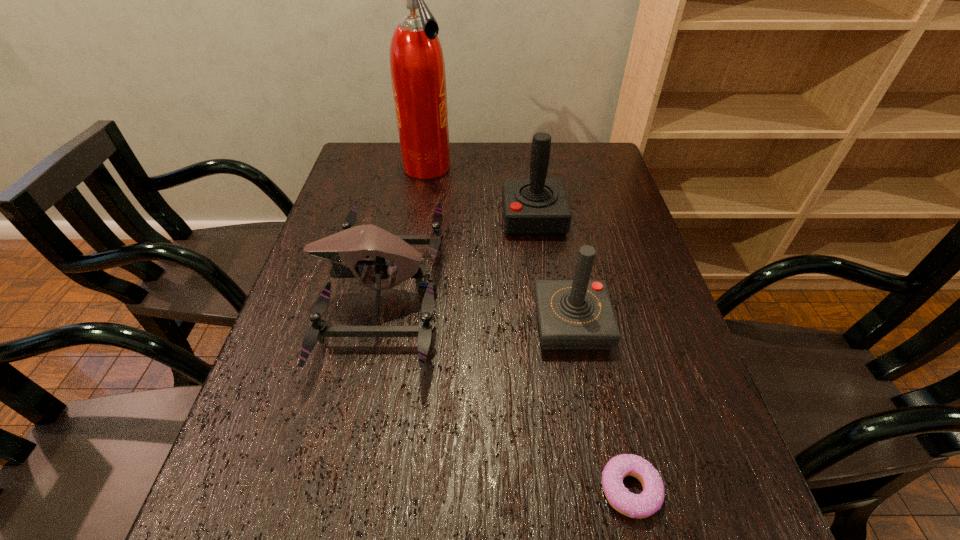
Where is `vacant space located 0.390m on the base of the farther joystick`? vacant space located 0.390m on the base of the farther joystick is located at coordinates (362, 218).

Where is `vacant region located on the base of the farther joystick`? vacant region located on the base of the farther joystick is located at coordinates (395, 218).

You are a GUI agent. You are given a task and a screenshot of the screen. Output one action in this format:
    pyautogui.click(x=<x>, y=<y>)
    Task: Click on the vacant space located 0.260m on the rectangular base of the shorter joystick
    The image size is (960, 540).
    Given the screenshot: What is the action you would take?
    416,323

I want to click on vacant space located on the rectangular base of the shorter joystick, so click(373, 323).

Where is `vacant space situated on the rectangular base of the shorter joystick`? The image size is (960, 540). vacant space situated on the rectangular base of the shorter joystick is located at coordinates (503, 323).

You are a GUI agent. You are given a task and a screenshot of the screen. Output one action in this format:
    pyautogui.click(x=<x>, y=<y>)
    Task: Click on the vacant space located on the front-facing side of the drone
    The width and height of the screenshot is (960, 540).
    Given the screenshot: What is the action you would take?
    pyautogui.click(x=581, y=294)

Where is `vacant space located 0.090m on the back of the doughnut`? The image size is (960, 540). vacant space located 0.090m on the back of the doughnut is located at coordinates point(612,410).

I want to click on object located at the far edge, so click(417, 66).

Identify the location of object situated at the near edge. The image size is (960, 540). coord(643,505).

The image size is (960, 540). What are the coordinates of `object that is at the left edge` in the screenshot? It's located at pos(345,249).